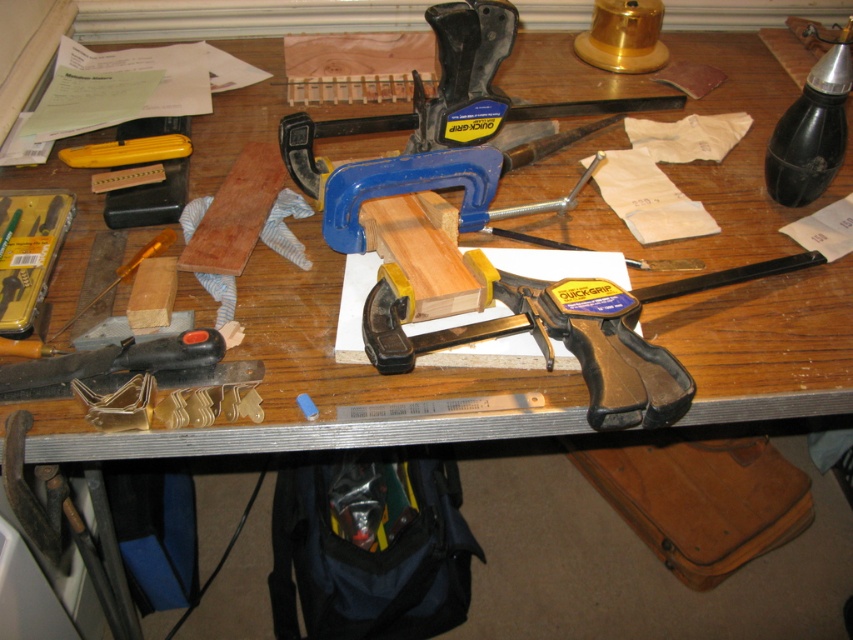
You are a carpenter who needs to place a 10cm tall tool on your workbench. You have a matte plastic clamp at center and a satin chrome screwdriver at lower left. Which object can you place the tool on top of without it falling off?

The matte plastic clamp at center has a greater height compared to the satin chrome screwdriver at lower left, so the tool can be placed on top of the matte plastic clamp at center since it provides a stable, higher surface.

You are a carpenter working on this bench. You need to access the matte plastic clamp at center. Is it currently covered by the wooden at center?

The wooden at center is above the matte plastic clamp at center, so yes, the wooden at center is covering the matte plastic clamp at center.